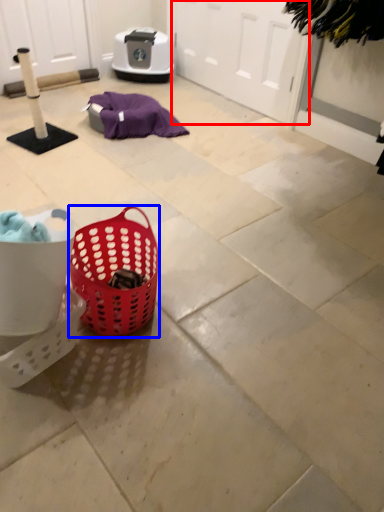
Question: Which object is further to the camera taking this photo, screen door (highlighted by a red box) or picnic basket (highlighted by a blue box)?

Choices:
 (A) screen door
 (B) picnic basket

Answer: (A)